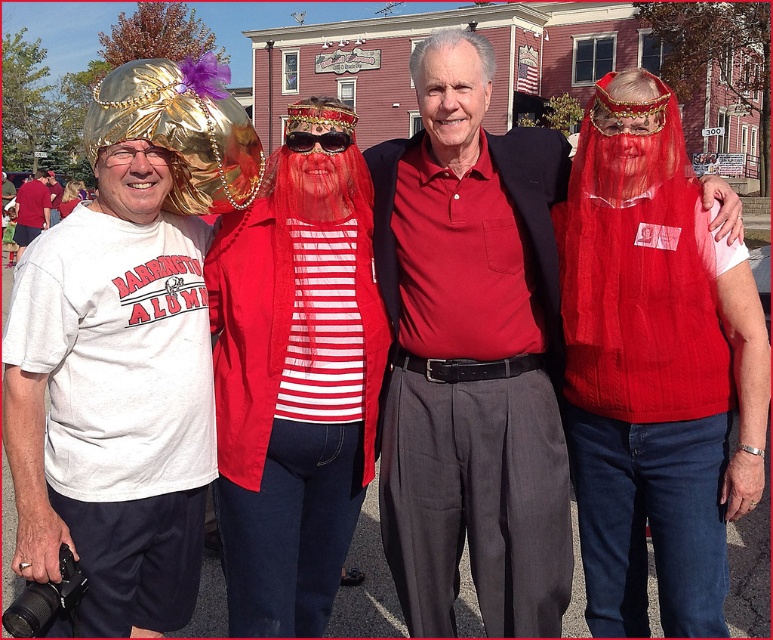
Does metallic gold turban at left come in front of sunglasses at center?

Yes.

Which is more to the left, metallic gold turban at left or sunglasses at center?

From the viewer's perspective, metallic gold turban at left appears more on the left side.

Who is more forward, (118, 499) or (346, 134)?

Point (118, 499) is more forward.

This screenshot has height=640, width=773. What are the coordinates of `metallic gold turban at left` in the screenshot? It's located at (126, 349).

Which is more to the right, metallic gold turban at left or matte white t-shirt at left?

Positioned to the right is metallic gold turban at left.

Between point (84, 513) and point (48, 224), which one is positioned behind?

Positioned behind is point (48, 224).

Who is more distant from viewer, (111, 97) or (19, 234)?

Positioned behind is point (19, 234).

Identify the location of metallic gold turban at left. (126, 349).

Is point (290, 173) positioned behind point (298, 141)?

Yes, point (290, 173) is farther from viewer.

Between red matte veil at center and sunglasses at center, which one appears on the right side from the viewer's perspective?

sunglasses at center

Is point (250, 330) positioned in front of point (317, 141)?

Yes, it is in front of point (317, 141).

Where is `red matte veil at center`? The image size is (773, 640). red matte veil at center is located at coordinates (295, 380).